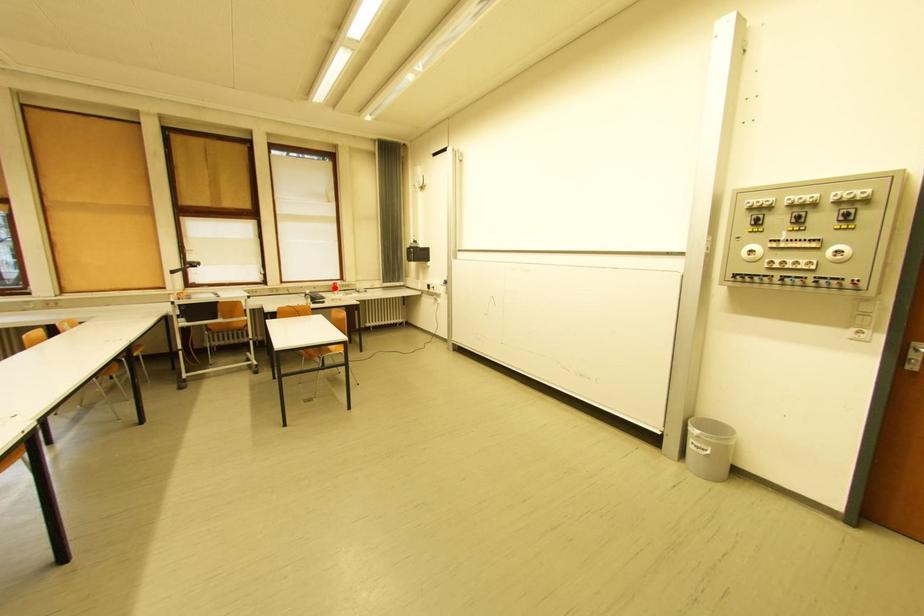
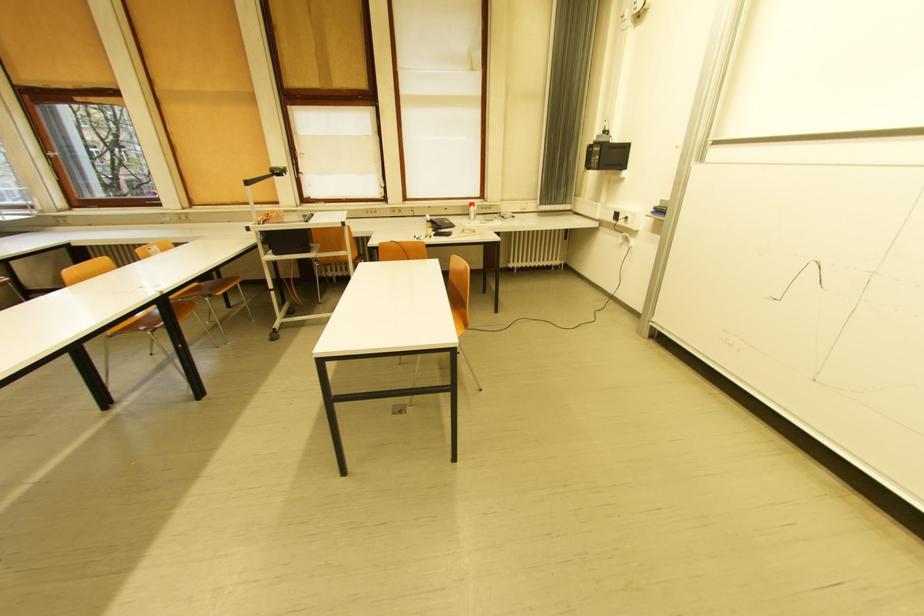
Where in the second image is the point corresponding to the highlighted location from the first image?

(469, 208)